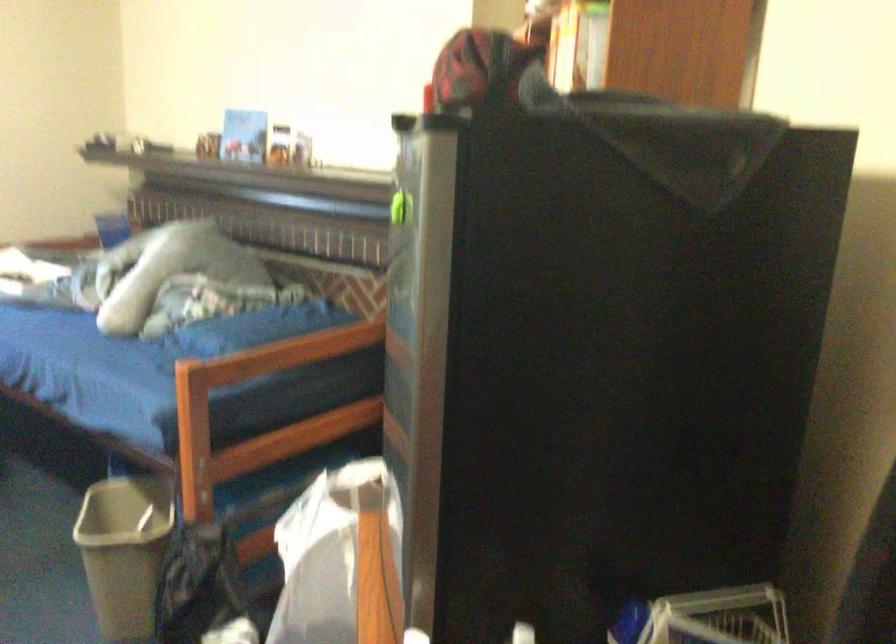
At what (x,y) coordinates should I click in order to perform the action: click on white wire basket. Please return your answer as a coordinate pair (x, y). This screenshot has width=896, height=644. Looking at the image, I should click on (719, 617).